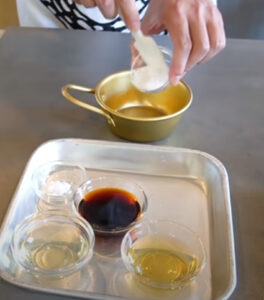
This screenshot has width=264, height=300. Identify the location of handle to hold the cup. [x=87, y=106].